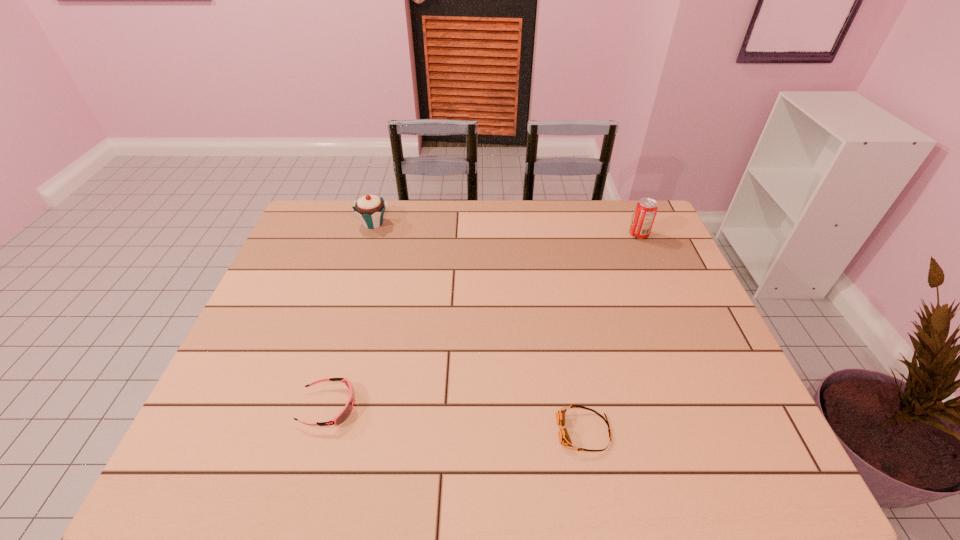
The height and width of the screenshot is (540, 960). I want to click on free space located with the lenses facing forward on the right goggles, so click(470, 431).

The width and height of the screenshot is (960, 540). Find the location of `soda that is at the far edge`. soda that is at the far edge is located at coordinates (646, 209).

This screenshot has width=960, height=540. What are the coordinates of `cupcake that is at the far edge` in the screenshot? It's located at (370, 209).

The width and height of the screenshot is (960, 540). What are the coordinates of `object that is at the near edge` in the screenshot? It's located at (564, 438).

At what (x,y) coordinates should I click in order to perform the action: click on object located at the right edge. Please return your answer as a coordinate pair (x, y). Looking at the image, I should click on (646, 209).

This screenshot has width=960, height=540. Identify the location of object at the far right corner. (646, 209).

I want to click on free space at the far edge of the desktop, so pos(545,234).

The height and width of the screenshot is (540, 960). I want to click on vacant space at the near edge, so click(x=487, y=478).

The height and width of the screenshot is (540, 960). I want to click on free location at the left edge of the desktop, so click(239, 429).

Locate an element on the screen. The image size is (960, 540). free space at the right edge of the desktop is located at coordinates (651, 307).